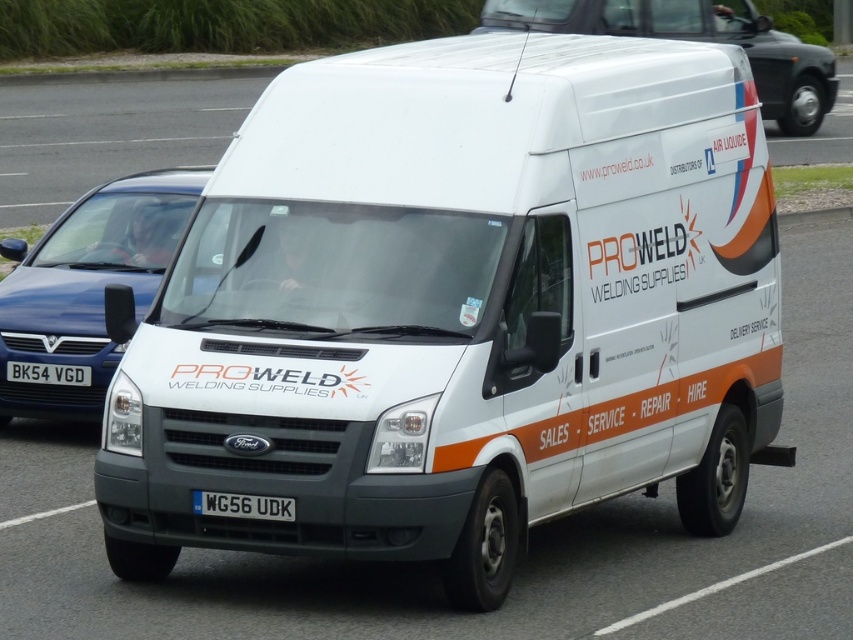
Question: Which point is closer to the camera?

Choices:
 (A) white matte van at center
 (B) white matte van at upper center

Answer: (B)

Question: Which point is closer to the camera taking this photo?

Choices:
 (A) (18, 364)
 (B) (144, 301)
 (C) (280, 500)
 (D) (508, 4)

Answer: (C)

Question: From the image, what is the correct spatial relationship of white matte van at center in relation to white matte van at upper center?

Choices:
 (A) above
 (B) below

Answer: (B)

Question: Does white plastic license plate at center appear on the right side of black plastic license plate at lower left?

Choices:
 (A) no
 (B) yes

Answer: (B)

Question: Observing the image, what is the correct spatial positioning of white matte van at center in reference to black plastic license plate at lower left?

Choices:
 (A) below
 (B) above

Answer: (B)

Question: Which point appears farthest from the camera in this image?

Choices:
 (A) (624, 22)
 (B) (241, 502)

Answer: (A)